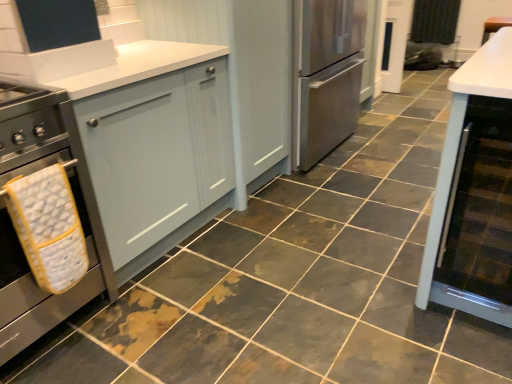
Describe the element at coordinates (434, 21) in the screenshot. I see `black fabric curtain at upper right` at that location.

You are a GUI agent. You are given a task and a screenshot of the screen. Output one action in this format:
    pyautogui.click(x=<x>, y=<y>)
    Task: Click on the matte gray cabinet at center, positioned as the second cabinetry in right-to-left order
    The width and height of the screenshot is (512, 384).
    Given the screenshot: What is the action you would take?
    pyautogui.click(x=240, y=70)

Describe the element at coordinates (474, 192) in the screenshot. I see `matte glass cabinet at right, positioned as the 1th cabinetry in right-to-left order` at that location.

What is the approximate width of matte gray cabinet at left, the third cabinetry when ordered from right to left?

The width of matte gray cabinet at left, the third cabinetry when ordered from right to left, is 29.58 inches.

Describe the element at coordinates (14, 228) in the screenshot. The width and height of the screenshot is (512, 384). I see `stainless steel oven at left` at that location.

Where is `black fabric curtain at upper right`? The width and height of the screenshot is (512, 384). black fabric curtain at upper right is located at coordinates (434, 21).

Measure the distance from stainless steel oven at left to black fabric curtain at upper right.

stainless steel oven at left is 17.69 feet away from black fabric curtain at upper right.

Who is smaller, stainless steel oven at left or black fabric curtain at upper right?

black fabric curtain at upper right.

From a real-world perspective, between stainless steel oven at left and black fabric curtain at upper right, who is vertically lower?

In real-world perspective, black fabric curtain at upper right is lower.

Consider the image. Does stainless steel oven at left have a greater height compared to black fabric curtain at upper right?

Yes, stainless steel oven at left is taller than black fabric curtain at upper right.

At what (x,y) coordinates should I click in order to perform the action: click on dark above the matte gray cabinet at left, which is the 1th cabinetry in left-to-right order (from the image's perspective). Please return your answer as a coordinate pair (x, y). Looking at the image, I should click on (434, 21).

Between matte gray cabinet at left, the third cabinetry when ordered from right to left, and black fabric curtain at upper right, which one is positioned in front?

matte gray cabinet at left, the third cabinetry when ordered from right to left, is more forward.

Is matte gray cabinet at left, the third cabinetry when ordered from right to left, facing towards black fabric curtain at upper right?

No, matte gray cabinet at left, the third cabinetry when ordered from right to left, is not oriented towards black fabric curtain at upper right.

Can you confirm if matte gray cabinet at left, the third cabinetry when ordered from right to left, is bigger than black fabric curtain at upper right?

Correct, matte gray cabinet at left, the third cabinetry when ordered from right to left, is larger in size than black fabric curtain at upper right.

Looking at this image, from a real-world perspective, which object rests below the other?

matte glass cabinet at right, positioned as the 1th cabinetry in right-to-left order, from a real-world perspective.

Is stainless steel oven at left directly adjacent to matte glass cabinet at right, which is the third cabinetry in left-to-right order?

No, stainless steel oven at left is not with matte glass cabinet at right, which is the third cabinetry in left-to-right order.

Locate an element on the screen. Image resolution: width=512 pixels, height=384 pixels. home appliance in front of the matte glass cabinet at right, which is the third cabinetry in left-to-right order is located at coordinates (14, 228).

Is stainless steel oven at left positioned with its back to yellow fabric oven mitt at left?

Yes, yellow fabric oven mitt at left is at the back of stainless steel oven at left.

In the image, is stainless steel oven at left positioned in front of or behind yellow fabric oven mitt at left?

In the image, stainless steel oven at left appears in front of yellow fabric oven mitt at left.

Is stainless steel oven at left to the left of yellow fabric oven mitt at left from the viewer's perspective?

Yes.

How many degrees apart are the facing directions of stainless steel oven at left and yellow fabric oven mitt at left?

The angular difference between stainless steel oven at left and yellow fabric oven mitt at left is 0.00106 degrees.

Is matte gray cabinet at center, positioned as the second cabinetry in right-to-left order, completely or partially outside of matte gray cabinet at left, which is the 1th cabinetry in left-to-right order?

Yes, matte gray cabinet at center, positioned as the second cabinetry in right-to-left order, is not within matte gray cabinet at left, which is the 1th cabinetry in left-to-right order.

Is point (241, 210) positioned behind point (62, 108)?

That is True.

Between matte gray cabinet at center, placed as the 2th cabinetry when sorted from left to right, and matte gray cabinet at left, the third cabinetry when ordered from right to left, which one has smaller width?

Thinner between the two is matte gray cabinet at center, placed as the 2th cabinetry when sorted from left to right.

Does matte gray cabinet at center, placed as the 2th cabinetry when sorted from left to right, come behind matte gray cabinet at left, which is the 1th cabinetry in left-to-right order?

That is True.

Is black fabric curtain at upper right directly adjacent to stainless steel oven at left?

They are not placed beside each other.

Is black fabric curtain at upper right not within stainless steel oven at left?

black fabric curtain at upper right is positioned outside stainless steel oven at left.

Is black fabric curtain at upper right behind stainless steel oven at left?

Yes.

Is black fabric curtain at upper right outside of matte gray cabinet at left, the third cabinetry when ordered from right to left?

black fabric curtain at upper right lies outside matte gray cabinet at left, the third cabinetry when ordered from right to left,'s area.

From the picture: Which is more to the left, black fabric curtain at upper right or matte gray cabinet at left, which is the 1th cabinetry in left-to-right order?

matte gray cabinet at left, which is the 1th cabinetry in left-to-right order, is more to the left.

Based on the photo, between black fabric curtain at upper right and matte gray cabinet at left, the third cabinetry when ordered from right to left, which one is positioned behind?

black fabric curtain at upper right is more distant.

Consider the image. From a real-world perspective, which is physically below, black fabric curtain at upper right or matte gray cabinet at left, which is the 1th cabinetry in left-to-right order?

black fabric curtain at upper right.

Locate an element on the screen. dark that appears above the stainless steel oven at left (from the image's perspective) is located at coordinates (434, 21).

You are a GUI agent. You are given a task and a screenshot of the screen. Output one action in this format:
    pyautogui.click(x=<x>, y=<y>)
    Task: Click on the dark lying behind the matte gray cabinet at left, the third cabinetry when ordered from right to left
    
    Given the screenshot: What is the action you would take?
    pyautogui.click(x=434, y=21)

Looking at this image, considering their positions, is black fabric curtain at upper right positioned further to matte gray cabinet at center, positioned as the second cabinetry in right-to-left order, than matte gray cabinet at left, the third cabinetry when ordered from right to left?

black fabric curtain at upper right is further to matte gray cabinet at center, positioned as the second cabinetry in right-to-left order.

When comparing their distances from stainless steel oven at left, does black fabric curtain at upper right or matte glass cabinet at right, which is the third cabinetry in left-to-right order, seem closer?

matte glass cabinet at right, which is the third cabinetry in left-to-right order, is positioned closer to the anchor stainless steel oven at left.

Estimate the real-world distances between objects in this image. Which object is closer to matte gray cabinet at left, which is the 1th cabinetry in left-to-right order, black fabric curtain at upper right or stainless steel oven at left?

Among the two, stainless steel oven at left is located nearer to matte gray cabinet at left, which is the 1th cabinetry in left-to-right order.

From the image, which object appears to be nearer to black fabric curtain at upper right, yellow fabric oven mitt at left or stainless steel oven at left?

Based on the image, stainless steel oven at left appears to be nearer to black fabric curtain at upper right.

Which object lies nearer to the anchor point black fabric curtain at upper right, matte gray cabinet at left, which is the 1th cabinetry in left-to-right order, or matte gray cabinet at center, placed as the 2th cabinetry when sorted from left to right?

matte gray cabinet at center, placed as the 2th cabinetry when sorted from left to right, is closer to black fabric curtain at upper right.

In the scene shown: Based on their spatial positions, is yellow fabric oven mitt at left or matte gray cabinet at center, placed as the 2th cabinetry when sorted from left to right, closer to black fabric curtain at upper right?

matte gray cabinet at center, placed as the 2th cabinetry when sorted from left to right, lies closer to black fabric curtain at upper right than the other object.

Considering their positions, is matte glass cabinet at right, which is the third cabinetry in left-to-right order, positioned closer to yellow fabric oven mitt at left than matte gray cabinet at center, placed as the 2th cabinetry when sorted from left to right?

Based on the image, matte gray cabinet at center, placed as the 2th cabinetry when sorted from left to right, appears to be nearer to yellow fabric oven mitt at left.

From the image, which object appears to be nearer to matte gray cabinet at left, the third cabinetry when ordered from right to left, stainless steel oven at left or matte gray cabinet at center, positioned as the second cabinetry in right-to-left order?

Among the two, stainless steel oven at left is located nearer to matte gray cabinet at left, the third cabinetry when ordered from right to left.

Identify the location of material between stainless steel oven at left and matte gray cabinet at left, the third cabinetry when ordered from right to left, along the z-axis. The height and width of the screenshot is (384, 512). (48, 227).

Identify the location of cabinetry between stainless steel oven at left and matte gray cabinet at center, placed as the 2th cabinetry when sorted from left to right. The image size is (512, 384). (118, 168).

Locate an element on the screen. Image resolution: width=512 pixels, height=384 pixels. cabinetry between matte gray cabinet at left, the third cabinetry when ordered from right to left, and matte glass cabinet at right, which is the third cabinetry in left-to-right order, in the horizontal direction is located at coordinates (240, 70).

At what (x,y) coordinates should I click in order to perform the action: click on material located between stainless steel oven at left and matte gray cabinet at center, placed as the 2th cabinetry when sorted from left to right, in the left-right direction. Please return your answer as a coordinate pair (x, y). Looking at the image, I should click on (48, 227).